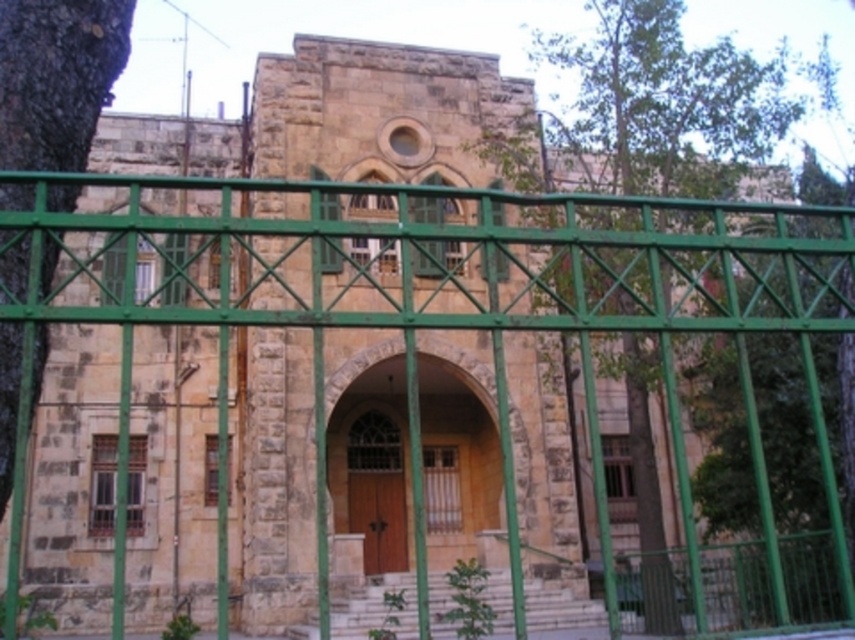
Question: Which object appears closest to the camera in this image?

Choices:
 (A) dark green bark tree at left
 (B) green leafy tree at center

Answer: (A)

Question: Is green metal fence at center closer to camera compared to green leafy tree at center?

Choices:
 (A) yes
 (B) no

Answer: (A)

Question: Is green metal fence at center positioned behind dark green bark tree at left?

Choices:
 (A) yes
 (B) no

Answer: (B)

Question: Which object appears closest to the camera in this image?

Choices:
 (A) wooden door at center
 (B) green leafy tree at center
 (C) dark green bark tree at left

Answer: (C)

Question: Which of the following is the farthest from the observer?

Choices:
 (A) dark green bark tree at left
 (B) wooden door at center
 (C) green leafy tree at center

Answer: (B)

Question: Does dark green bark tree at left come in front of wooden door at center?

Choices:
 (A) no
 (B) yes

Answer: (B)